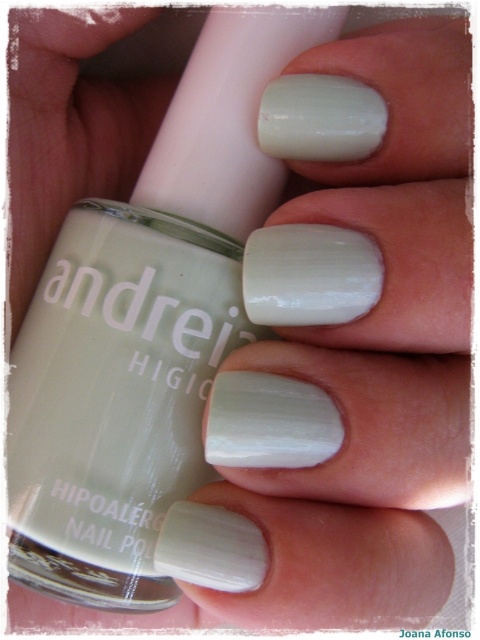
Question: Which point appears farthest from the camera in this image?

Choices:
 (A) (264, 168)
 (B) (435, 317)

Answer: (A)

Question: Among these objects, which one is nearest to the camera?

Choices:
 (A) matte white nails at center
 (B) matte white nail polish at center

Answer: (A)

Question: Does matte white nail polish at center appear over matte white nails at center?

Choices:
 (A) no
 (B) yes

Answer: (A)

Question: Which of the following is the farthest from the observer?

Choices:
 (A) matte white nail polish at center
 (B) matte white nails at center

Answer: (A)

Question: Observing the image, what is the correct spatial positioning of matte white nail polish at center in reference to matte white nails at center?

Choices:
 (A) left
 (B) right

Answer: (A)

Question: Can you confirm if matte white nail polish at center is positioned above matte white nails at center?

Choices:
 (A) yes
 (B) no

Answer: (B)